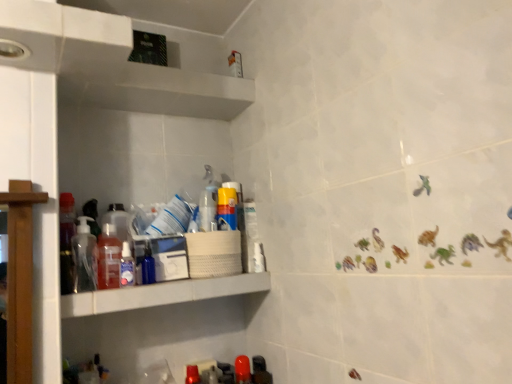
Question: Should I look upward or downward to see translucent plastic bottle at shelf left, which is counted as the 6th bottle, starting from the right?

Choices:
 (A) up
 (B) down

Answer: (B)

Question: From a real-world perspective, is matte red plastic bottle at lower center, positioned as the 5th bottle in left-to-right order, located beneath white plastic shelf at center?

Choices:
 (A) yes
 (B) no

Answer: (A)

Question: Considering the relative sizes of matte red plastic bottle at lower center, which appears as the 4th bottle when viewed from the right, and white plastic shelf at center in the image provided, is matte red plastic bottle at lower center, which appears as the 4th bottle when viewed from the right, smaller than white plastic shelf at center?

Choices:
 (A) yes
 (B) no

Answer: (A)

Question: Is matte red plastic bottle at lower center, which appears as the 4th bottle when viewed from the right, far away from white plastic shelf at center?

Choices:
 (A) yes
 (B) no

Answer: (B)

Question: Does matte red plastic bottle at lower center, which appears as the 4th bottle when viewed from the right, turn towards white plastic shelf at center?

Choices:
 (A) no
 (B) yes

Answer: (A)

Question: Considering the relative positions of matte red plastic bottle at lower center, which appears as the 4th bottle when viewed from the right, and white plastic shelf at center in the image provided, is matte red plastic bottle at lower center, which appears as the 4th bottle when viewed from the right, to the right of white plastic shelf at center from the viewer's perspective?

Choices:
 (A) no
 (B) yes

Answer: (B)

Question: Is matte red plastic bottle at lower center, which appears as the 4th bottle when viewed from the right, shorter than white plastic shelf at center?

Choices:
 (A) yes
 (B) no

Answer: (B)

Question: Does glossy plastic bottle at lower center, the 7th bottle viewed from the left, have a larger size compared to transparent plastic spray bottle at center, which is counted as the 3th bottle, starting from the right?

Choices:
 (A) no
 (B) yes

Answer: (B)

Question: Considering the relative sizes of glossy plastic bottle at lower center, the 7th bottle viewed from the left, and transparent plastic spray bottle at center, the sixth bottle in the left-to-right sequence, in the image provided, is glossy plastic bottle at lower center, the 7th bottle viewed from the left, shorter than transparent plastic spray bottle at center, the sixth bottle in the left-to-right sequence,?

Choices:
 (A) no
 (B) yes

Answer: (A)

Question: Is transparent plastic spray bottle at center, which is counted as the 3th bottle, starting from the right, inside glossy plastic bottle at lower center, which is the second bottle in right-to-left order?

Choices:
 (A) no
 (B) yes

Answer: (A)

Question: Can you confirm if glossy plastic bottle at lower center, the 7th bottle viewed from the left, is wider than transparent plastic spray bottle at center, which is counted as the 3th bottle, starting from the right?

Choices:
 (A) no
 (B) yes

Answer: (B)

Question: Is the depth of glossy plastic bottle at lower center, which is the second bottle in right-to-left order, greater than that of transparent plastic spray bottle at center, the sixth bottle in the left-to-right sequence?

Choices:
 (A) yes
 (B) no

Answer: (B)

Question: From the image's perspective, is glossy plastic bottle at lower center, which is the second bottle in right-to-left order, located above transparent plastic spray bottle at center, which is counted as the 3th bottle, starting from the right?

Choices:
 (A) no
 (B) yes

Answer: (A)

Question: Can you confirm if glossy plastic bottle at lower center, the 7th bottle viewed from the left, is shorter than translucent plastic soap dispenser at left, the eighth bottle from the right?

Choices:
 (A) yes
 (B) no

Answer: (A)